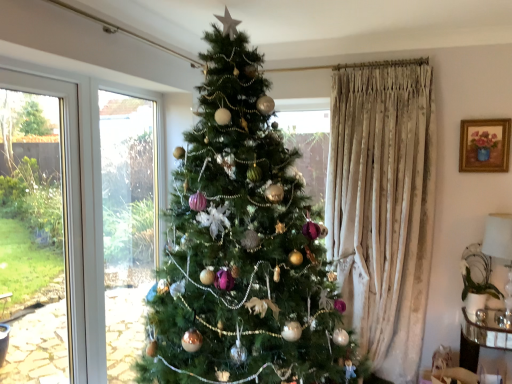
Question: Should I look upward or downward to see white glossy lampshade at right?

Choices:
 (A) up
 (B) down

Answer: (B)

Question: From the image's perspective, does green matte christmas tree at center appear lower than white glossy lampshade at right?

Choices:
 (A) yes
 (B) no

Answer: (B)

Question: Does green matte christmas tree at center lie in front of white glossy lampshade at right?

Choices:
 (A) no
 (B) yes

Answer: (B)

Question: Does green matte christmas tree at center contain white glossy lampshade at right?

Choices:
 (A) no
 (B) yes

Answer: (A)

Question: Is the surface of green matte christmas tree at center in direct contact with white glossy lampshade at right?

Choices:
 (A) yes
 (B) no

Answer: (B)

Question: Can you confirm if green matte christmas tree at center is wider than white glossy lampshade at right?

Choices:
 (A) no
 (B) yes

Answer: (B)

Question: Would you say green matte christmas tree at center is outside white glossy lampshade at right?

Choices:
 (A) no
 (B) yes

Answer: (B)

Question: Can green matte christmas tree at center be found inside white glossy lampshade at right?

Choices:
 (A) yes
 (B) no

Answer: (B)

Question: Is white glossy lampshade at right smaller than green matte christmas tree at center?

Choices:
 (A) yes
 (B) no

Answer: (A)

Question: Considering the relative sizes of white glossy lampshade at right and green matte christmas tree at center in the image provided, is white glossy lampshade at right shorter than green matte christmas tree at center?

Choices:
 (A) no
 (B) yes

Answer: (B)

Question: Does white glossy lampshade at right appear on the left side of green matte christmas tree at center?

Choices:
 (A) yes
 (B) no

Answer: (B)

Question: Is white glossy lampshade at right positioned far away from green matte christmas tree at center?

Choices:
 (A) yes
 (B) no

Answer: (A)

Question: Can you confirm if white glossy lampshade at right is positioned to the right of green matte christmas tree at center?

Choices:
 (A) yes
 (B) no

Answer: (A)

Question: From a real-world perspective, is gold-framed painting at upper right located beneath white glossy lampshade at right?

Choices:
 (A) yes
 (B) no

Answer: (B)